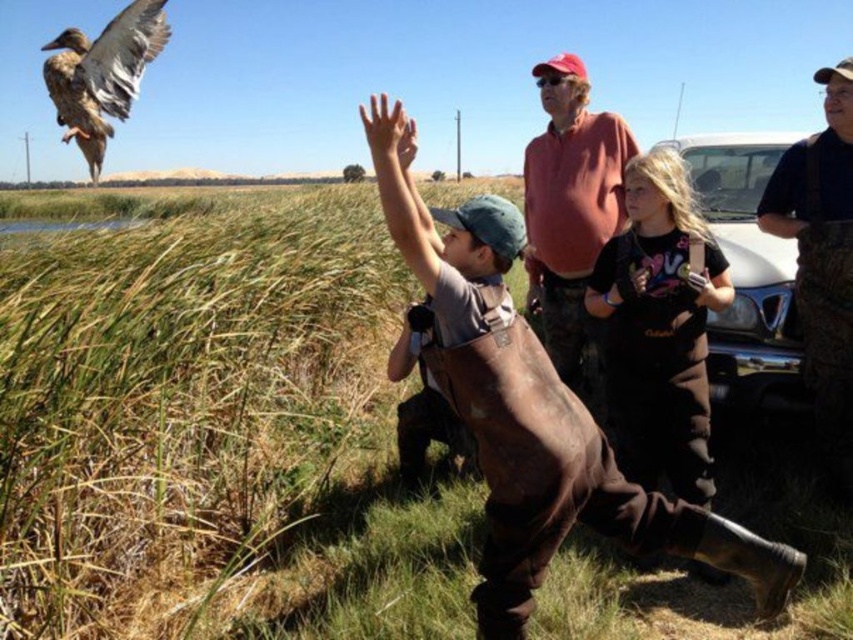
Question: Which of the following is the closest to the observer?

Choices:
 (A) black cotton shirt at center
 (B) brown leather overalls at center
 (C) white matte car at center-right
 (D) brown camo overalls at right

Answer: (B)

Question: Does matte red sweater at center come in front of brown camo overalls at right?

Choices:
 (A) yes
 (B) no

Answer: (B)

Question: Does brown leather overalls at center have a lesser width compared to white matte car at center-right?

Choices:
 (A) yes
 (B) no

Answer: (B)

Question: Estimate the real-world distances between objects in this image. Which object is closer to the black cotton shirt at center?

Choices:
 (A) matte red sweater at center
 (B) brown camo overalls at right

Answer: (A)

Question: Based on their relative distances, which object is nearer to the black cotton shirt at center?

Choices:
 (A) brown camo overalls at right
 (B) brown feathered duck at upper left
 (C) white matte car at center-right

Answer: (A)

Question: Is brown leather overalls at center in front of brown feathered duck at upper left?

Choices:
 (A) yes
 (B) no

Answer: (A)